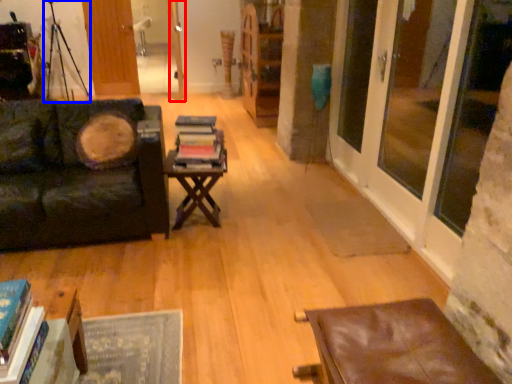
Question: Which of the following is the closest to the observer, door (highlighted by a red box) or tripod (highlighted by a blue box)?

Choices:
 (A) door
 (B) tripod

Answer: (B)